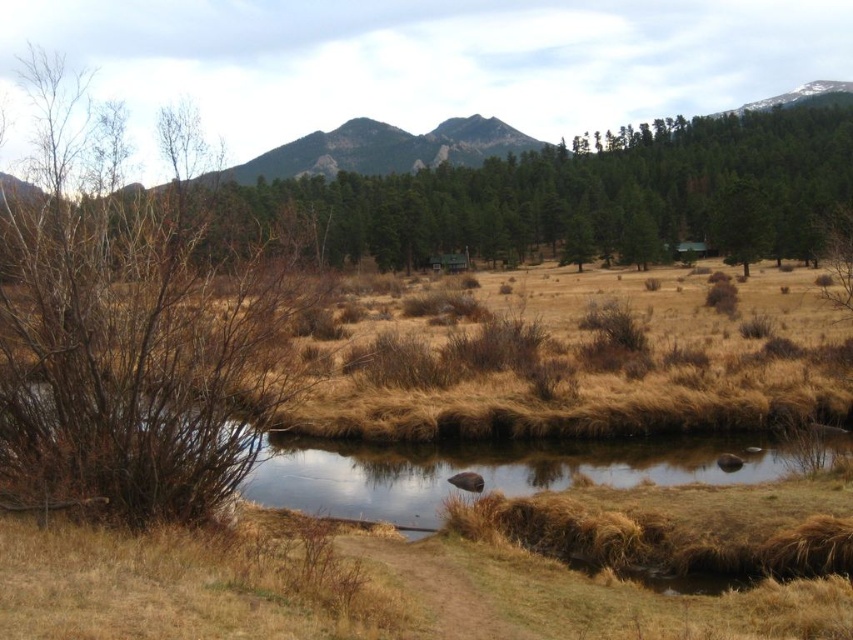
Does green matte tree at upper center come in front of brown grassy water at lower center?

No.

Between point (515, 253) and point (840, 440), which one is positioned behind?

Positioned behind is point (515, 253).

Is point (538, 164) closer to viewer compared to point (283, 480)?

No, (538, 164) is further to viewer.

At what (x,y) coordinates should I click in order to perform the action: click on green matte tree at upper center. Please return your answer as a coordinate pair (x, y). Image resolution: width=853 pixels, height=640 pixels. Looking at the image, I should click on (595, 189).

Is brown bare branches at left shorter than brown grassy water at lower center?

No, brown bare branches at left is not shorter than brown grassy water at lower center.

I want to click on brown bare branches at left, so click(x=138, y=321).

Identify the location of brown bare branches at left. The width and height of the screenshot is (853, 640). (138, 321).

Does brown bare branches at left have a greater width compared to green matte tree at upper center?

In fact, brown bare branches at left might be narrower than green matte tree at upper center.

Is brown bare branches at left positioned before green matte tree at upper center?

That is True.

Between point (126, 291) and point (668, 163), which one is positioned in front?

Point (126, 291) is in front.

Locate an element on the screen. brown bare branches at left is located at coordinates (138, 321).